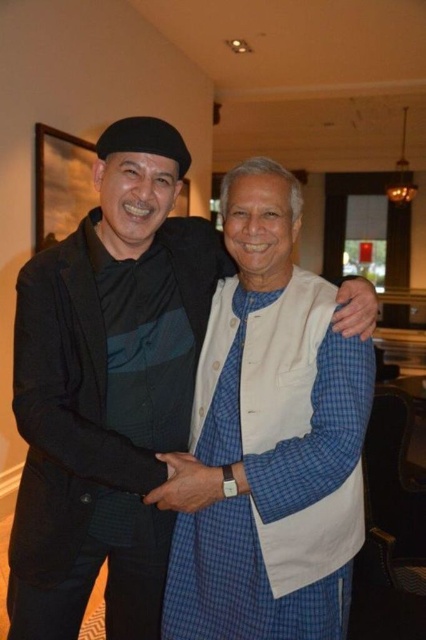
You are a photographer trying to capture the blue checkered kurta at center in the image. What are the coordinates where you should focus your camera?

The blue checkered kurta at center is located at coordinates point [108,388].